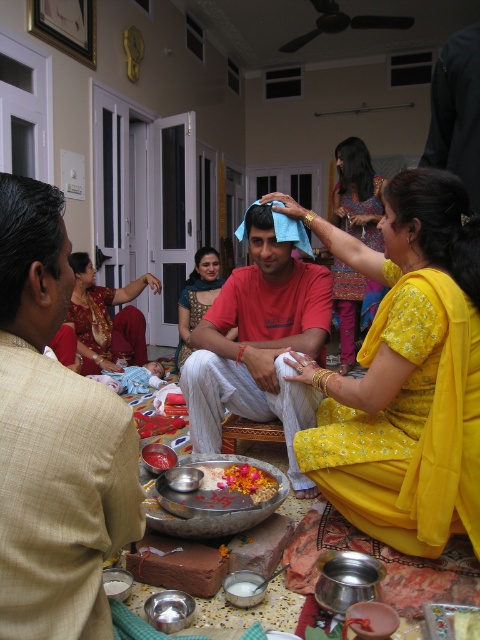
You are standing in the room where the gathering is taking place. You notice two points marked in the scene. Which point, point (200, 296) or point (172, 461), is closer to you?

Point (200, 296) is closer to you because it is further to the viewer than point (172, 461).